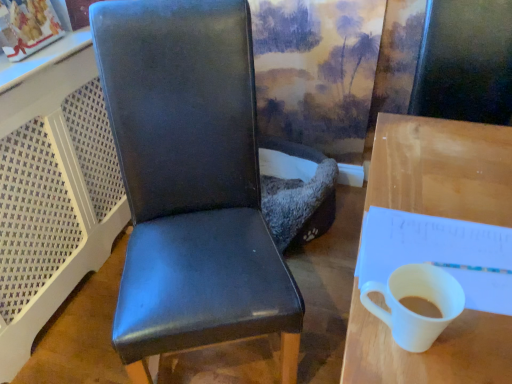
This screenshot has height=384, width=512. Identify the location of free space above wooden desk at right (from a real-world perspective). (456, 200).